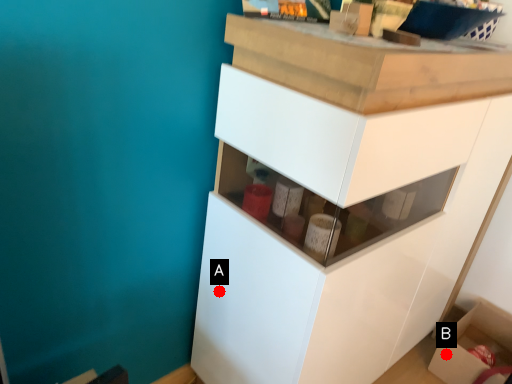
Question: Two points are circled on the image, labeled by A and B beside each circle. Which of the following is the farthest from the observer?

Choices:
 (A) A is further
 (B) B is further

Answer: (B)